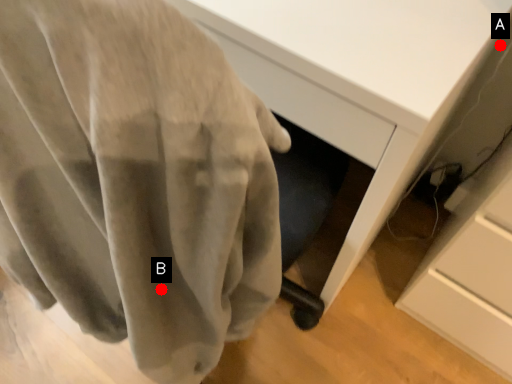
Question: Two points are circled on the image, labeled by A and B beside each circle. Among these points, which one is nearest to the camera?

Choices:
 (A) A is closer
 (B) B is closer

Answer: (B)